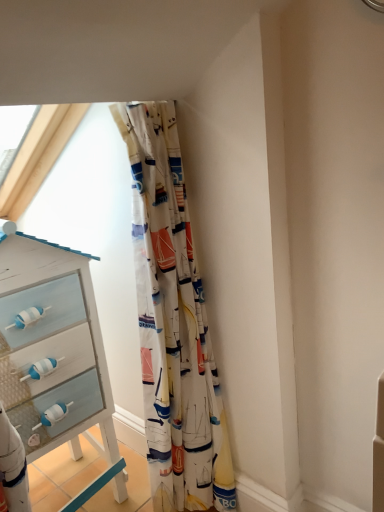
Question: From the image's perspective, is printed fabric curtain at center located above or below white painted wood chest of drawers at left?

Choices:
 (A) below
 (B) above

Answer: (B)

Question: In terms of width, does printed fabric curtain at center look wider or thinner when compared to white painted wood chest of drawers at left?

Choices:
 (A) thin
 (B) wide

Answer: (A)

Question: Which is correct: printed fabric curtain at center is inside white painted wood chest of drawers at left, or outside of it?

Choices:
 (A) outside
 (B) inside

Answer: (A)

Question: From the image's perspective, is white painted wood chest of drawers at left located above or below printed fabric curtain at center?

Choices:
 (A) below
 (B) above

Answer: (A)

Question: From a real-world perspective, is white painted wood chest of drawers at left positioned above or below printed fabric curtain at center?

Choices:
 (A) below
 (B) above

Answer: (A)

Question: Is white painted wood chest of drawers at left taller or shorter than printed fabric curtain at center?

Choices:
 (A) short
 (B) tall

Answer: (A)

Question: Is white painted wood chest of drawers at left bigger or smaller than printed fabric curtain at center?

Choices:
 (A) small
 (B) big

Answer: (B)